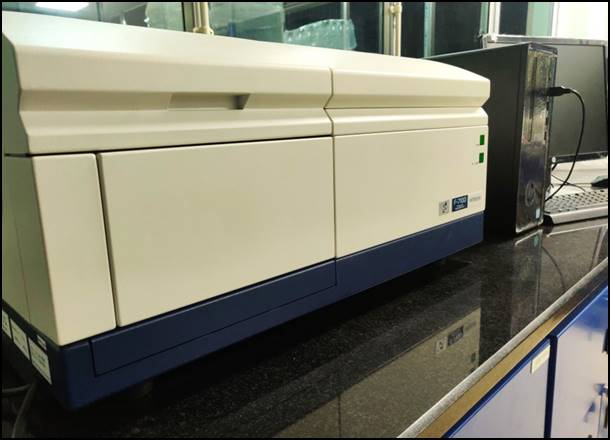
Where is `tabletop`? tabletop is located at coordinates (407, 330).